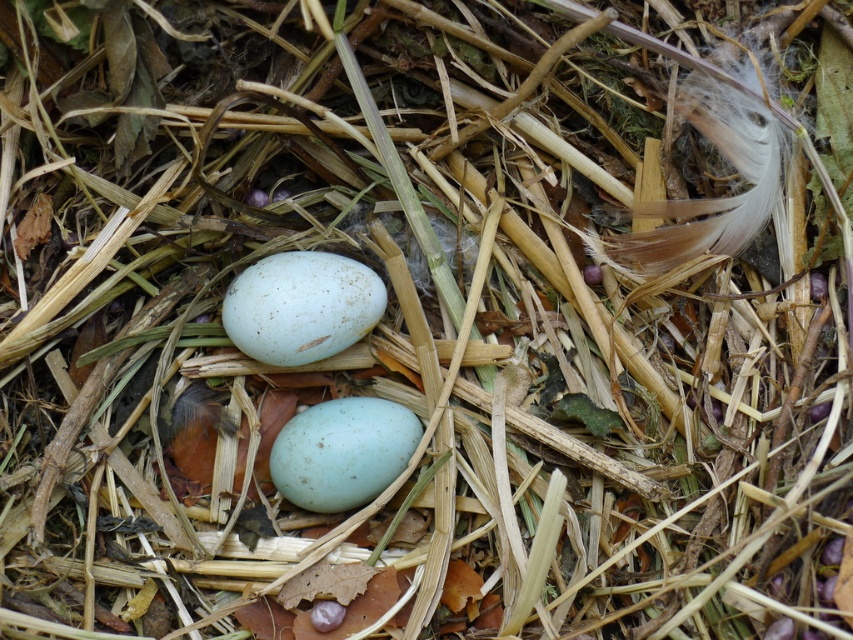
Can you confirm if speckled white egg at center is positioned to the right of matte blue egg at center?

No, speckled white egg at center is not to the right of matte blue egg at center.

Based on the photo, which is more to the right, speckled white egg at center or matte blue egg at center?

matte blue egg at center

Which is in front, point (341, 339) or point (274, 472)?

Point (341, 339) is more forward.

This screenshot has width=853, height=640. In order to click on speckled white egg at center in this screenshot , I will do `click(300, 307)`.